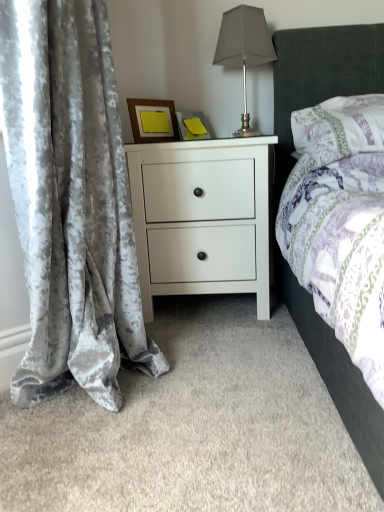
Question: Considering the relative sizes of satin silver table lamp at upper right and patterned fabric pillow at upper right in the image provided, is satin silver table lamp at upper right wider than patterned fabric pillow at upper right?

Choices:
 (A) no
 (B) yes

Answer: (A)

Question: From the image's perspective, would you say satin silver table lamp at upper right is positioned over patterned fabric pillow at upper right?

Choices:
 (A) yes
 (B) no

Answer: (A)

Question: Is satin silver table lamp at upper right far away from patterned fabric pillow at upper right?

Choices:
 (A) no
 (B) yes

Answer: (A)

Question: Is satin silver table lamp at upper right further to camera compared to patterned fabric pillow at upper right?

Choices:
 (A) no
 (B) yes

Answer: (B)

Question: Could you tell me if satin silver table lamp at upper right is turned towards patterned fabric pillow at upper right?

Choices:
 (A) no
 (B) yes

Answer: (A)

Question: Is satin silver table lamp at upper right in front of or behind white matte nightstand at center in the image?

Choices:
 (A) front
 (B) behind

Answer: (B)

Question: From the image's perspective, is satin silver table lamp at upper right located above or below white matte nightstand at center?

Choices:
 (A) above
 (B) below

Answer: (A)

Question: Would you say satin silver table lamp at upper right is inside or outside white matte nightstand at center?

Choices:
 (A) inside
 (B) outside

Answer: (B)

Question: Is point (243, 96) positioned closer to the camera than point (196, 244)?

Choices:
 (A) farther
 (B) closer

Answer: (A)

Question: From the image's perspective, is velvet gray curtain at left positioned above or below satin silver table lamp at upper right?

Choices:
 (A) below
 (B) above

Answer: (A)

Question: From a real-world perspective, relative to satin silver table lamp at upper right, is velvet gray curtain at left vertically above or below?

Choices:
 (A) above
 (B) below

Answer: (B)

Question: In terms of width, does velvet gray curtain at left look wider or thinner when compared to satin silver table lamp at upper right?

Choices:
 (A) thin
 (B) wide

Answer: (B)

Question: Is velvet gray curtain at left taller or shorter than satin silver table lamp at upper right?

Choices:
 (A) tall
 (B) short

Answer: (A)

Question: Relative to velvet gray curtain at left, is white matte nightstand at center in front or behind?

Choices:
 (A) behind
 (B) front

Answer: (A)

Question: From a real-world perspective, is white matte nightstand at center positioned above or below velvet gray curtain at left?

Choices:
 (A) above
 (B) below

Answer: (B)